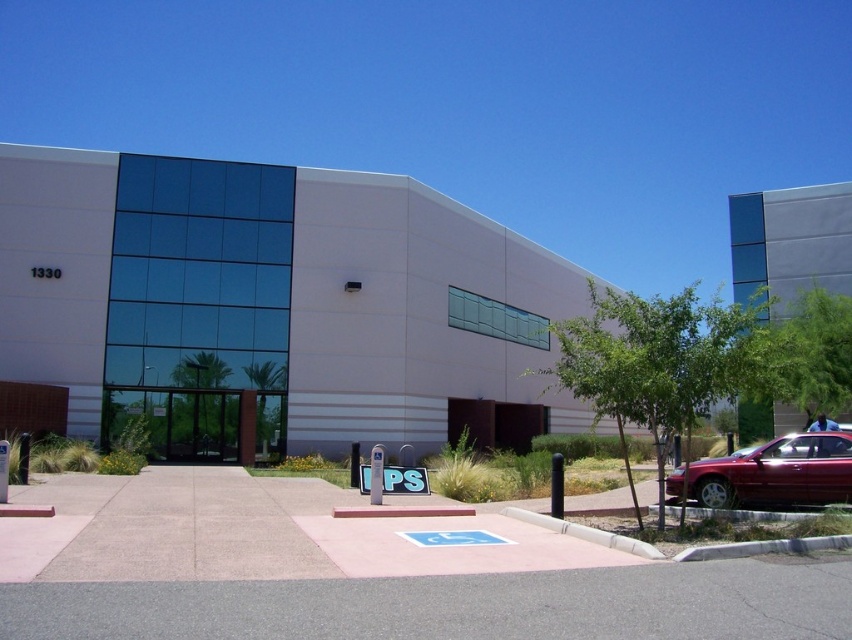
Question: Which of these objects is positioned farthest from the gray asphalt pavement at lower center?

Choices:
 (A) glossy metallic sedan at lower right
 (B) white plastic parking sign at center

Answer: (B)

Question: Is gray asphalt pavement at lower center smaller than white plastic parking sign at center?

Choices:
 (A) no
 (B) yes

Answer: (B)

Question: Among these points, which one is farthest from the camera?

Choices:
 (A) (186, 620)
 (B) (366, 486)
 (C) (799, 477)

Answer: (B)

Question: Is glossy metallic sedan at lower right thinner than white plastic parking sign at center?

Choices:
 (A) no
 (B) yes

Answer: (A)

Question: Which point appears farthest from the camera in this image?

Choices:
 (A) (412, 480)
 (B) (825, 456)

Answer: (A)

Question: Is glossy metallic sedan at lower right positioned behind white plastic parking sign at center?

Choices:
 (A) yes
 (B) no

Answer: (B)